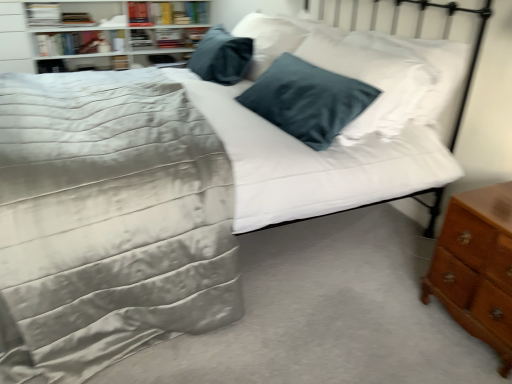
The width and height of the screenshot is (512, 384). Find the location of `vacant space to the left of brown wooden nightstand at lower right`. vacant space to the left of brown wooden nightstand at lower right is located at coordinates pos(390,311).